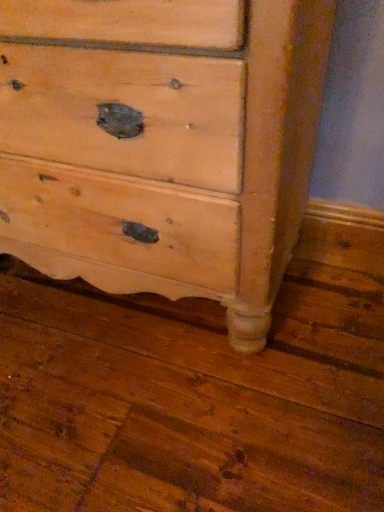
Find the location of a particular element. natural wood dresser at center is located at coordinates (162, 144).

What do you see at coordinates (162, 144) in the screenshot? I see `natural wood dresser at center` at bounding box center [162, 144].

Where is `natural wood dresser at center`? This screenshot has width=384, height=512. natural wood dresser at center is located at coordinates (162, 144).